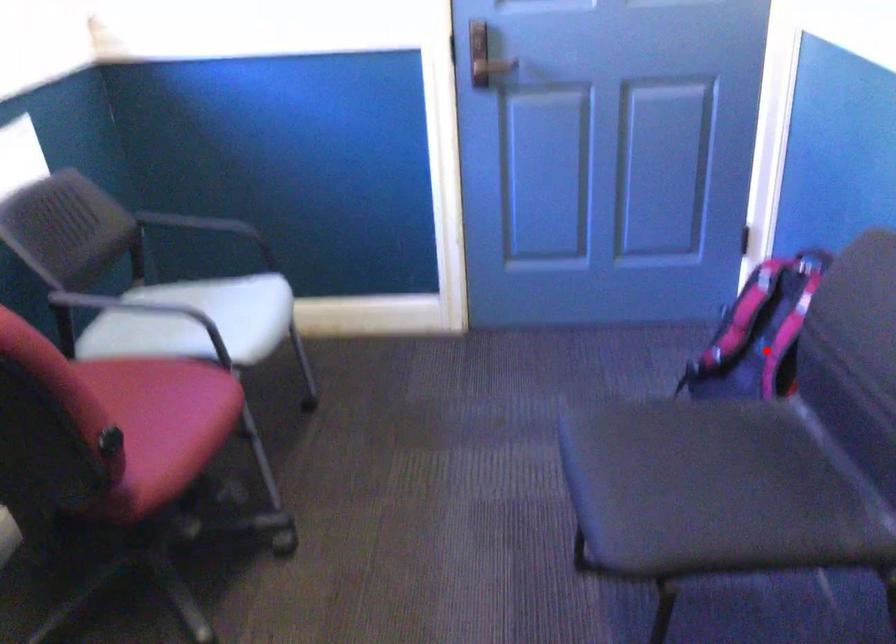
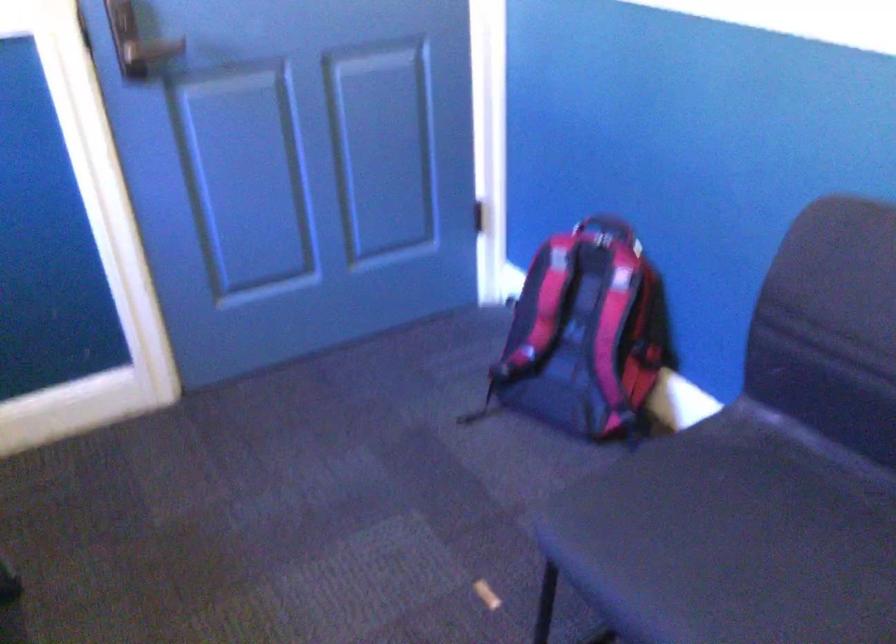
Where in the second image is the point corresponding to the highlighted location from the first image?

(584, 335)